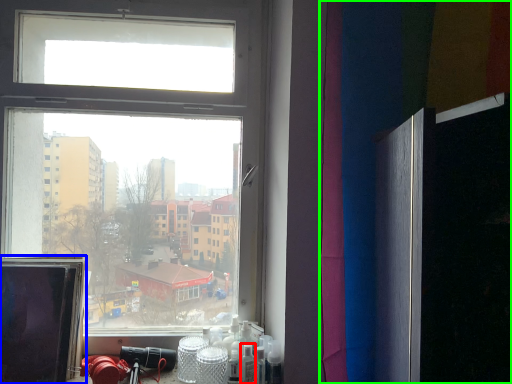
Question: Which object is the closest to the toiletry (highlighted by a red box)? Choose among these: computer screen (highlighted by a blue box) or curtain (highlighted by a green box).

Choices:
 (A) computer screen
 (B) curtain

Answer: (A)